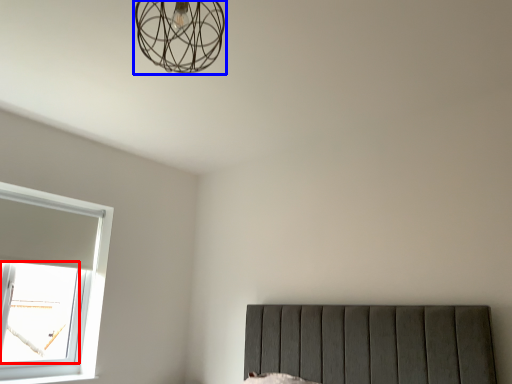
Question: Which object appears farthest to the camera in this image, window screen (highlighted by a red box) or lamp (highlighted by a blue box)?

Choices:
 (A) window screen
 (B) lamp

Answer: (A)